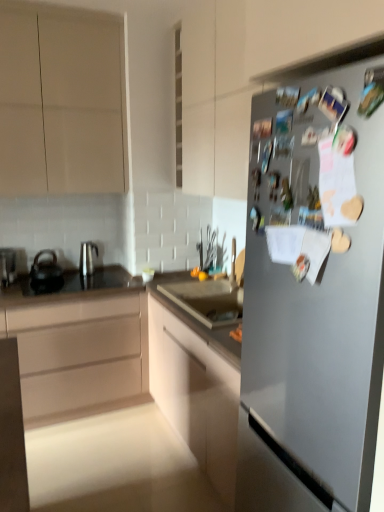
Locate an element on the screen. This screenshot has width=384, height=512. vacant area to the right of metallic silver kettle at left is located at coordinates (26, 286).